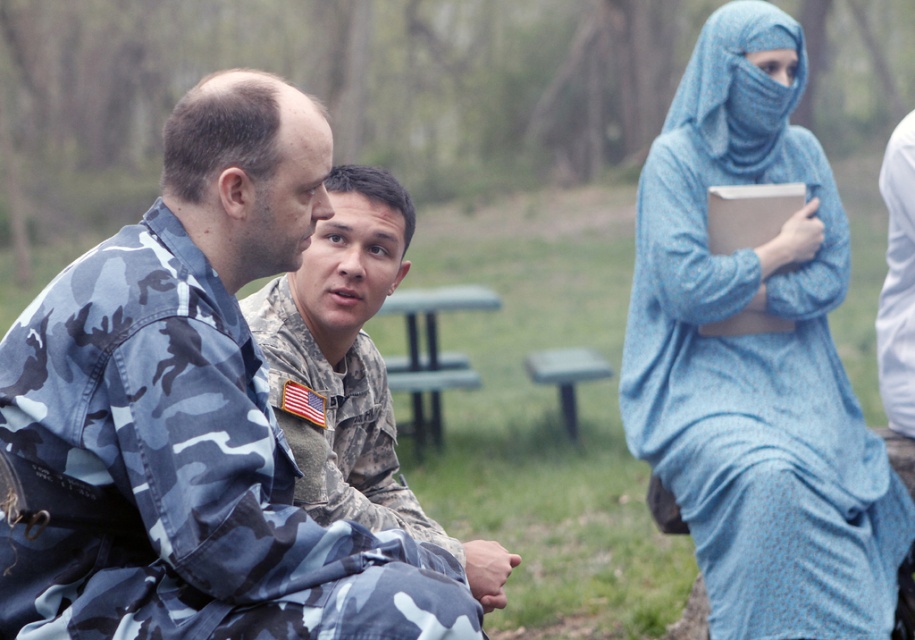
You are a photographer planning to take a group photo of the camouflage uniform at center and the green plastic picnic table at center. Considering their sizes, which one should you place closer to the camera to make them appear similar in size in the photo?

The camouflage uniform at center is much taller than the green plastic picnic table at center, so to make them appear similar in size in the photo, you should place the green plastic picnic table at center closer to the camera.

You are a photographer trying to capture both the camo fabric uniform at left and the blue printed dress at right in the same frame. Which subject should you focus on first to ensure both are in clear view?

The camo fabric uniform at left is smaller than the blue printed dress at right, so you should focus on the camo fabric uniform at left first to ensure both are in clear view.

You are standing in the park and see the camo fabric uniform at left and the blue printed dress at right. Which one is nearer to you?

The camo fabric uniform at left is closer to the viewer than the blue printed dress at right.